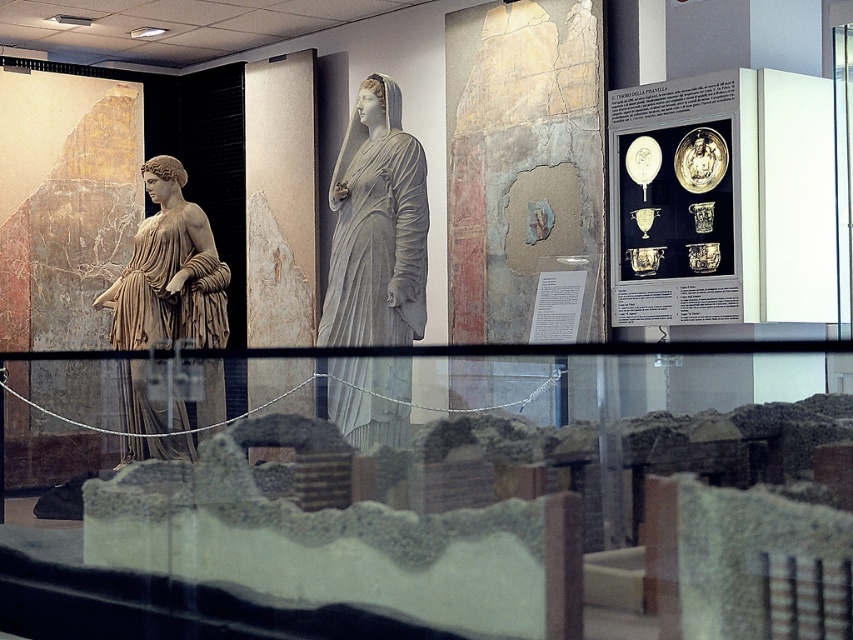
Consider the image. You are a tour guide explaining the statues in the museum. You need to point out the location of the gray stone statue at center relative to the matte beige statue at left. Which direction should you indicate?

The gray stone statue at center is to the right of the matte beige statue at left, so you should indicate the right direction.

You are an art student standing in the museum and want to sketch the gray stone statue at center. To do this, you need to position yourself directly in front of it. Based on the scene description, where should you stand relative to the statue?

You should stand directly in front of the gray stone statue at center, which is located at the central position in the scene as described.